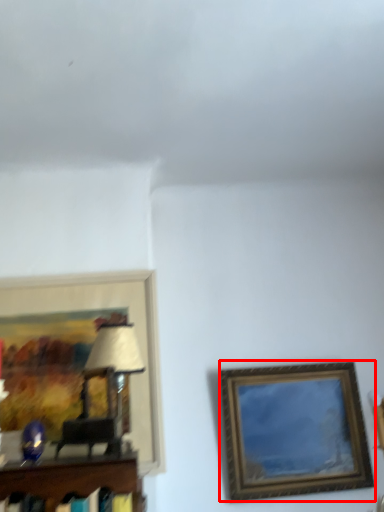
Question: From the image's perspective, what is the correct spatial positioning of picture frame (annotated by the red box) in reference to picture frame?

Choices:
 (A) above
 (B) below

Answer: (B)